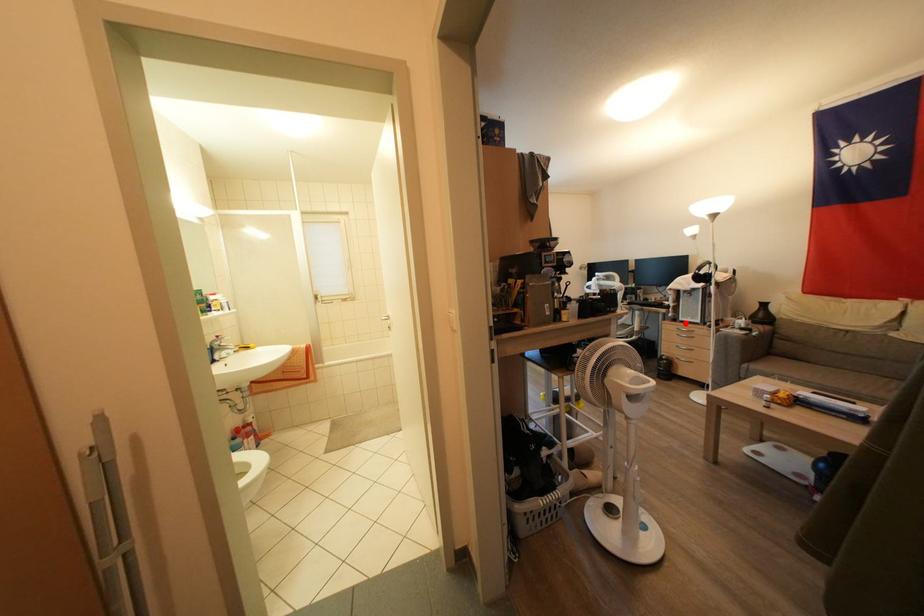
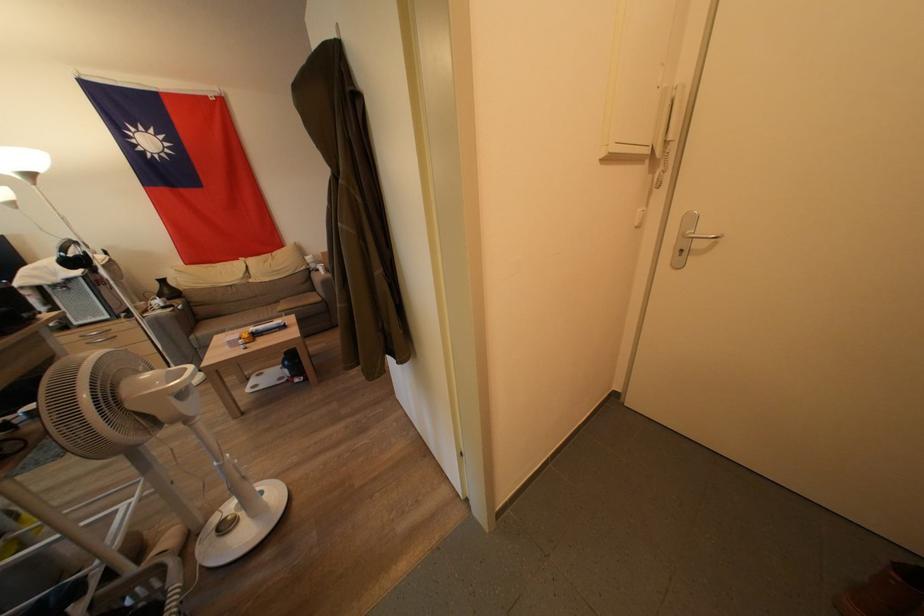
The point at the highlighted location is marked in the first image. Where is the corresponding point in the second image?

(81, 328)